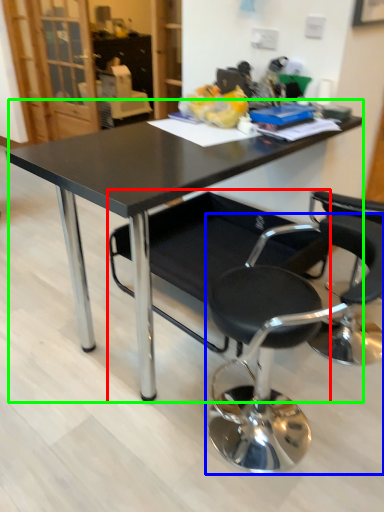
Question: Considering the real-world distances, which object is closest to chair (highlighted by a red box)? chair (highlighted by a blue box) or table (highlighted by a green box).

Choices:
 (A) chair
 (B) table

Answer: (A)